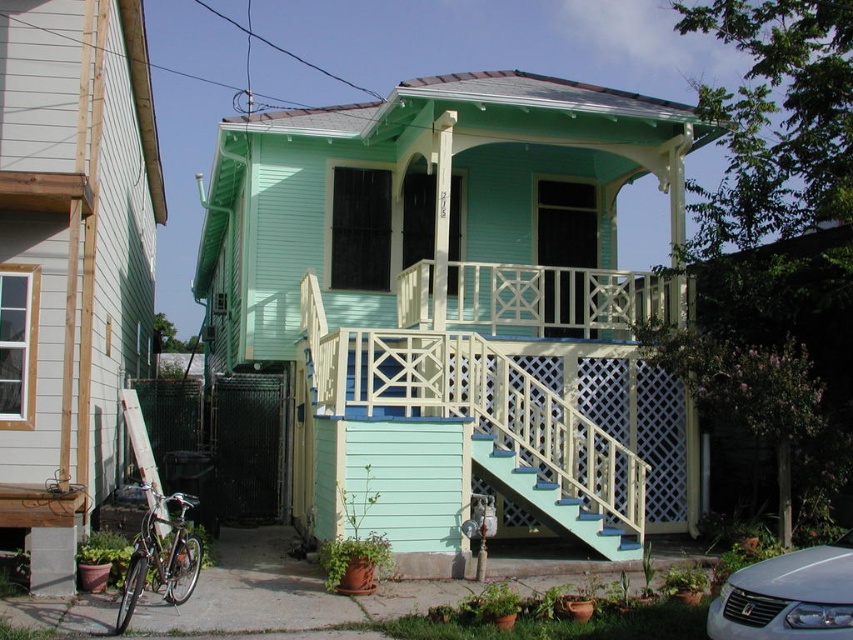
You are planning to move a large wooden bench that is 2 meters wide into the house. The bench is currently placed on the sidewalk in front of the house. Which set of stairs should you use to carry the bench into the house, the light blue wood stairs at center or the teal painted wood stairs at center?

You should use the light blue wood stairs at center because its width is larger than the teal painted wood stairs at center, making it more suitable for carrying the 2 meters wide bench.